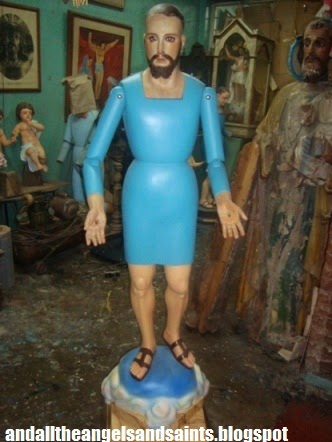
I want to click on blue robe, so click(x=156, y=144).